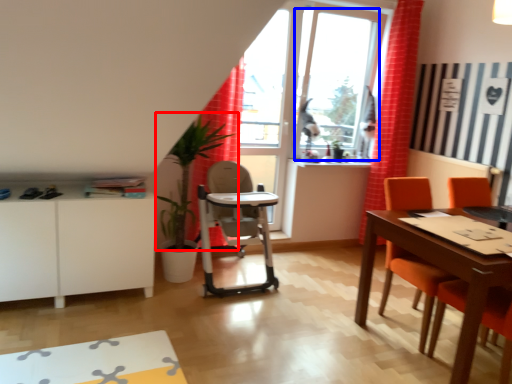
Question: Among these objects, which one is farthest to the camera, plant (highlighted by a red box) or window screen (highlighted by a blue box)?

Choices:
 (A) plant
 (B) window screen

Answer: (B)